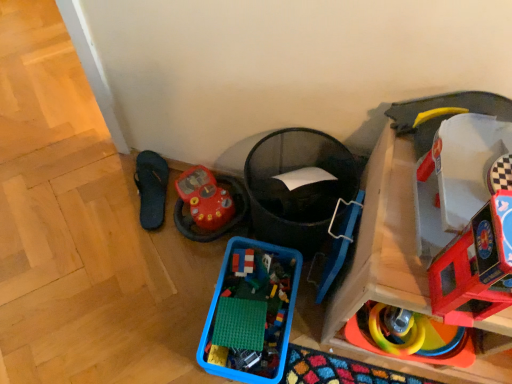
This screenshot has height=384, width=512. What are the coordinates of `free location to the left of smooth plastic toy car at right, arranged as the second toy when viewed from the right` in the screenshot? It's located at pos(391,275).